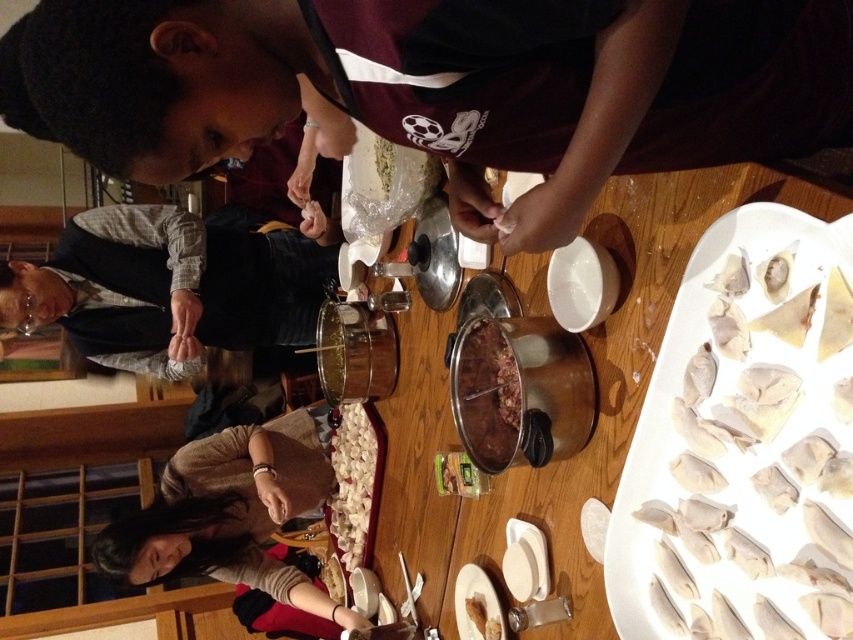
You are a chef preparing to serve the white matte dumplings at center and the brown matte dumpling at lower center. Which one should you pick up first if you want to serve the one closer to your left?

The white matte dumplings at center is to the left of the brown matte dumpling at lower center, so you should pick up the white matte dumplings at center first since it is closer to your left.

You are a guest at this cooking event and want to take a dumpling from the white paper plate at lower center. However, the gray fabric shirt at lower left is blocking your view. Can you reach the plate without moving the shirt?

The white paper plate at lower center is behind the gray fabric shirt at lower left, so you cannot reach it without moving the shirt.